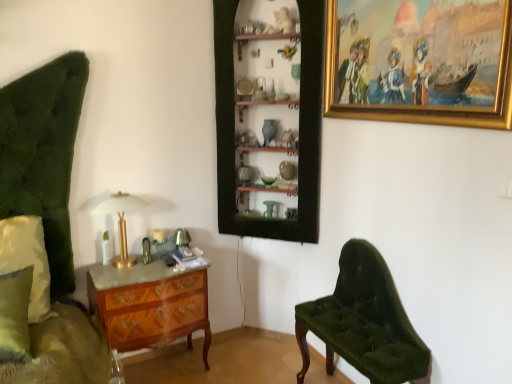
The width and height of the screenshot is (512, 384). I want to click on vacant region below wooden marquetry chest of drawers at lower left (from a real-world perspective), so click(x=164, y=367).